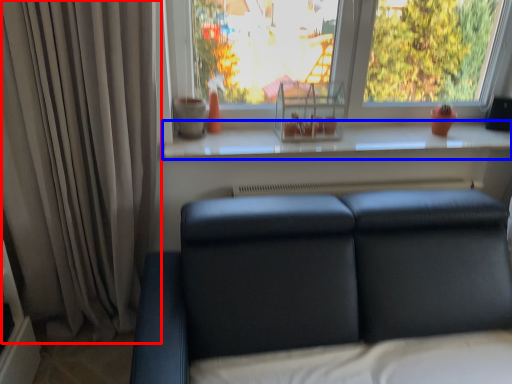
Question: Which object is closer to the camera taking this photo, curtain (highlighted by a red box) or window sill (highlighted by a blue box)?

Choices:
 (A) curtain
 (B) window sill

Answer: (A)